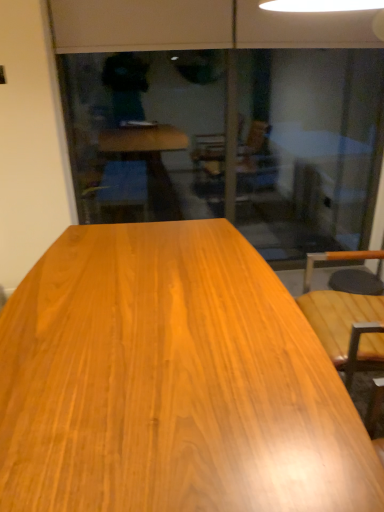
This screenshot has width=384, height=512. What are the coordinates of `empty space that is ontop of glossy wood table at center (from a real-world perspective)` in the screenshot? It's located at (137, 313).